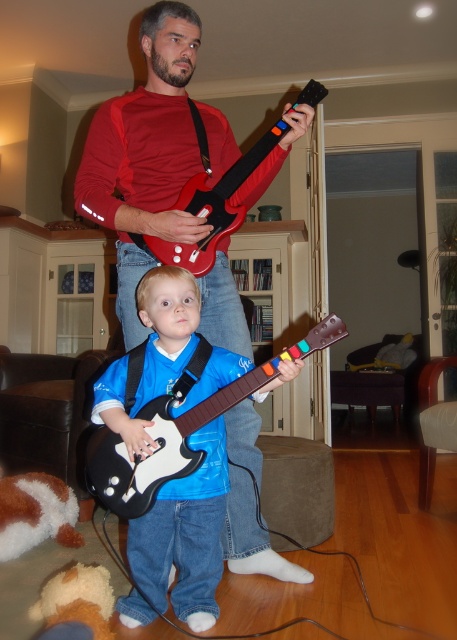
Question: Is black plastic guitar at center bigger than brown plush toy at lower left?

Choices:
 (A) no
 (B) yes

Answer: (B)

Question: Among these points, which one is farthest from the camera?

Choices:
 (A) (159, 484)
 (B) (201, 145)
 (C) (15, 483)

Answer: (C)

Question: Which point is farther from the camera taking this photo?

Choices:
 (A) (106, 621)
 (B) (176, 102)

Answer: (B)

Question: Is the position of matte red guitar at center less distant than that of black plastic guitar at center?

Choices:
 (A) yes
 (B) no

Answer: (B)

Question: Estimate the real-world distances between objects in this image. Which object is farther from the fluffy orange stuffed animal at lower left?

Choices:
 (A) matte red guitar at center
 (B) rubberized black guitar at upper center
 (C) black plastic guitar at center

Answer: (B)

Question: Does matte red guitar at center have a greater width compared to brown plush toy at lower left?

Choices:
 (A) yes
 (B) no

Answer: (A)